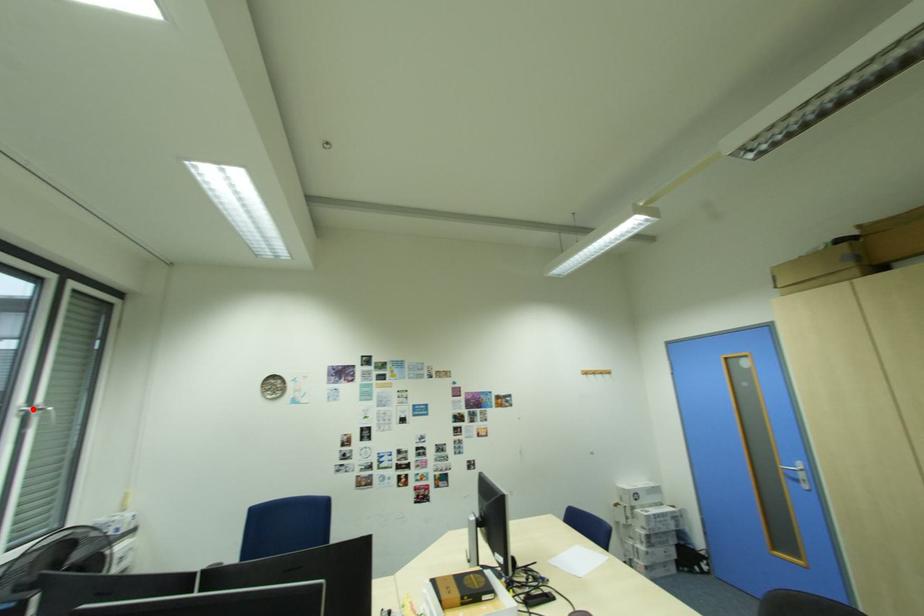
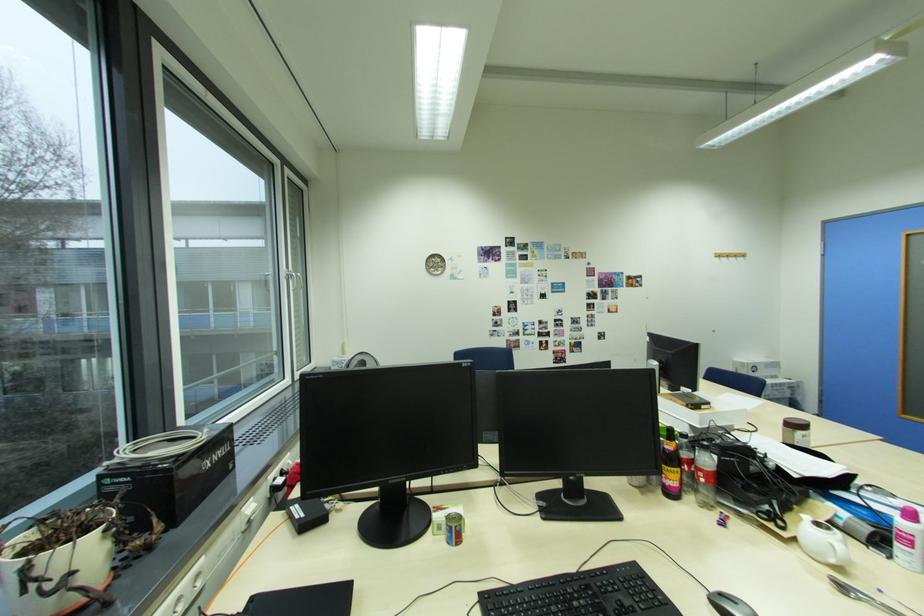
Question: I am providing you with two images of the same scene from different viewpoints. A red point is marked on the first image. At the location where the point appears in image 1, is it still visible in image 2?

Choices:
 (A) Yes
 (B) No

Answer: (A)